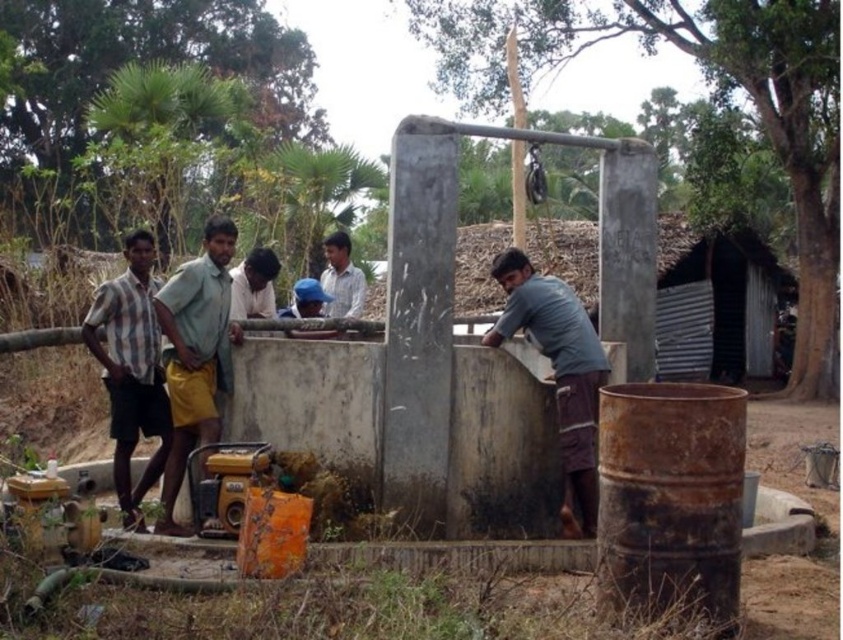
Question: Which point appears closest to the camera in this image?

Choices:
 (A) (213, 394)
 (B) (326, 273)
 (C) (237, 266)

Answer: (A)

Question: Does striped cotton shirt at left appear under light brown shirt at center?

Choices:
 (A) yes
 (B) no

Answer: (A)

Question: Which point appears farthest from the camera in this image?

Choices:
 (A) (199, 323)
 (B) (527, 308)
 (C) (342, 316)

Answer: (C)

Question: Does striped cotton shirt at left lie behind light brown shirt at center?

Choices:
 (A) yes
 (B) no

Answer: (B)

Question: Among these points, which one is nearest to the camera?

Choices:
 (A) (325, 308)
 (B) (239, 273)
 (C) (215, 349)
 (D) (581, 387)

Answer: (D)

Question: Can you confirm if light green fabric shirt at left is positioned to the right of light brown shirt at center?

Choices:
 (A) yes
 (B) no

Answer: (B)